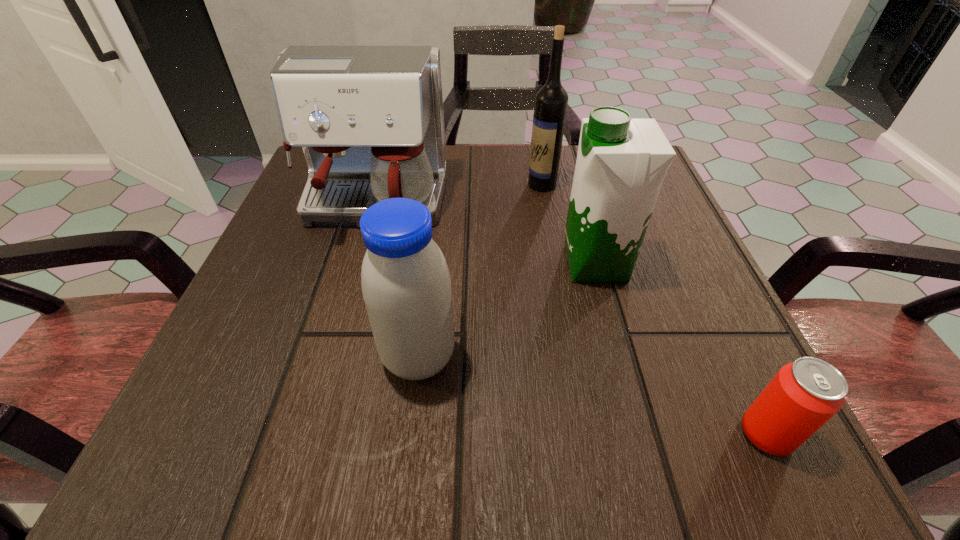
Image resolution: width=960 pixels, height=540 pixels. What are the coordinates of `empty location between the beer can and the nearer soya milk` in the screenshot? It's located at (592, 396).

You are a GUI agent. You are given a task and a screenshot of the screen. Output one action in this format:
    pyautogui.click(x=<x>, y=<y>)
    Task: Click on the vacant area that lies between the nearer soya milk and the wine bottle
    This screenshot has height=540, width=960.
    Given the screenshot: What is the action you would take?
    pyautogui.click(x=480, y=271)

I want to click on empty space between the farther soya milk and the rightmost object, so click(681, 349).

Where is `free space between the beer can and the wine bottle`? The height and width of the screenshot is (540, 960). free space between the beer can and the wine bottle is located at coordinates (654, 309).

Locate an element on the screen. The width and height of the screenshot is (960, 540). free spot between the wine bottle and the coffee maker is located at coordinates (457, 195).

I want to click on free space between the farther soya milk and the coffee maker, so click(x=484, y=234).

At what (x,y) coordinates should I click in order to perform the action: click on empty space that is in between the nearest object and the coffee maker. Please return your answer as a coordinate pair (x, y). Looking at the image, I should click on (569, 320).

Find the location of `vacant area between the shortest object and the second nearest object`. vacant area between the shortest object and the second nearest object is located at coordinates (592, 396).

Select which object appears as the fourth closest to the coffee maker. Please provide its 2D coordinates. Your answer should be formatted as a tuple, i.e. [(x, y)], where the tuple contains the x and y coordinates of a point satisfying the conditions above.

[(805, 394)]

At what (x,y) coordinates should I click in order to perform the action: click on the fourth closest object to the wine bottle. Please return your answer as a coordinate pair (x, y). Looking at the image, I should click on (805, 394).